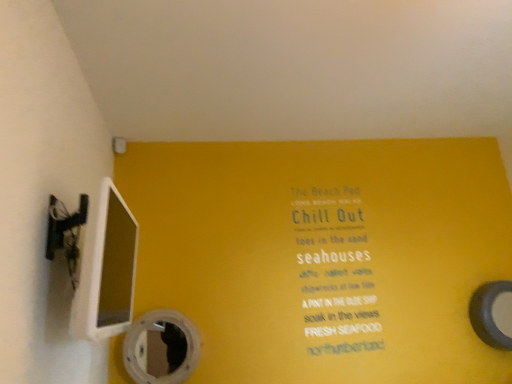
Question: From the image's perspective, relative to transparent plastic mirror at lower center, the first mirror from the front, is smooth gray mirror at right, arranged as the second mirror when viewed from the left, above or below?

Choices:
 (A) above
 (B) below

Answer: (A)

Question: Is smooth gray mirror at right, placed as the second mirror when sorted from front to back, bigger or smaller than transparent plastic mirror at lower center, which is the second mirror from right to left?

Choices:
 (A) small
 (B) big

Answer: (A)

Question: Does point (476, 307) appear closer or farther from the camera than point (190, 337)?

Choices:
 (A) farther
 (B) closer

Answer: (A)

Question: Is transparent plastic mirror at lower center, which is the 2th mirror from back to front, wider or thinner than smooth gray mirror at right, arranged as the second mirror when viewed from the left?

Choices:
 (A) thin
 (B) wide

Answer: (A)

Question: In the image, is transparent plastic mirror at lower center, which is the 2th mirror from back to front, positioned in front of or behind smooth gray mirror at right, arranged as the second mirror when viewed from the left?

Choices:
 (A) front
 (B) behind

Answer: (A)

Question: From the image's perspective, is transparent plastic mirror at lower center, the 1th mirror in the left-to-right sequence, above or below smooth gray mirror at right, acting as the 1th mirror starting from the back?

Choices:
 (A) above
 (B) below

Answer: (B)

Question: Which is correct: transparent plastic mirror at lower center, the first mirror from the front, is inside smooth gray mirror at right, which is counted as the first mirror, starting from the right, or outside of it?

Choices:
 (A) inside
 (B) outside

Answer: (B)